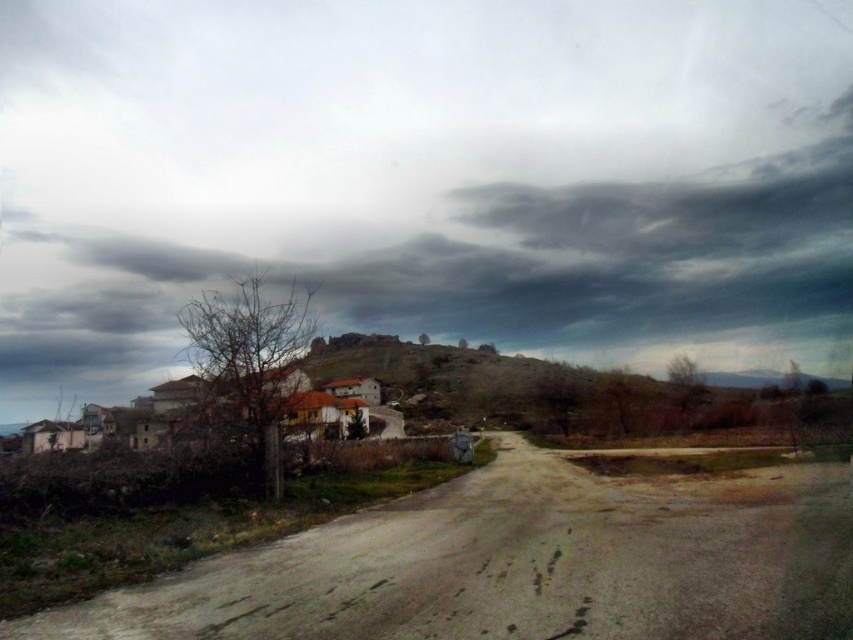
Can you confirm if dark gray cloud at upper center is bigger than brown stone hill at center?

Indeed, dark gray cloud at upper center has a larger size compared to brown stone hill at center.

Which is above, dark gray cloud at upper center or brown stone hill at center?

dark gray cloud at upper center is higher up.

Measure the distance between point (90, 200) and camera.

Point (90, 200) is 1493.85 feet away from camera.

The image size is (853, 640). I want to click on dark gray cloud at upper center, so click(x=453, y=253).

Is dull gray concrete road at center shorter than brown stone hill at center?

Yes, dull gray concrete road at center is shorter than brown stone hill at center.

Does dull gray concrete road at center have a greater height compared to brown stone hill at center?

In fact, dull gray concrete road at center may be shorter than brown stone hill at center.

The height and width of the screenshot is (640, 853). In order to click on dull gray concrete road at center in this screenshot , I will do [520, 564].

Identify the location of dull gray concrete road at center. (520, 564).

Is dark gray cloud at upper center positioned in front of dull gray concrete road at center?

No, dark gray cloud at upper center is further to the viewer.

Who is shorter, dark gray cloud at upper center or dull gray concrete road at center?

Standing shorter between the two is dull gray concrete road at center.

This screenshot has width=853, height=640. What are the coordinates of `dark gray cloud at upper center` in the screenshot? It's located at (453, 253).

This screenshot has height=640, width=853. Find the location of `dark gray cloud at upper center`. dark gray cloud at upper center is located at coordinates (453, 253).